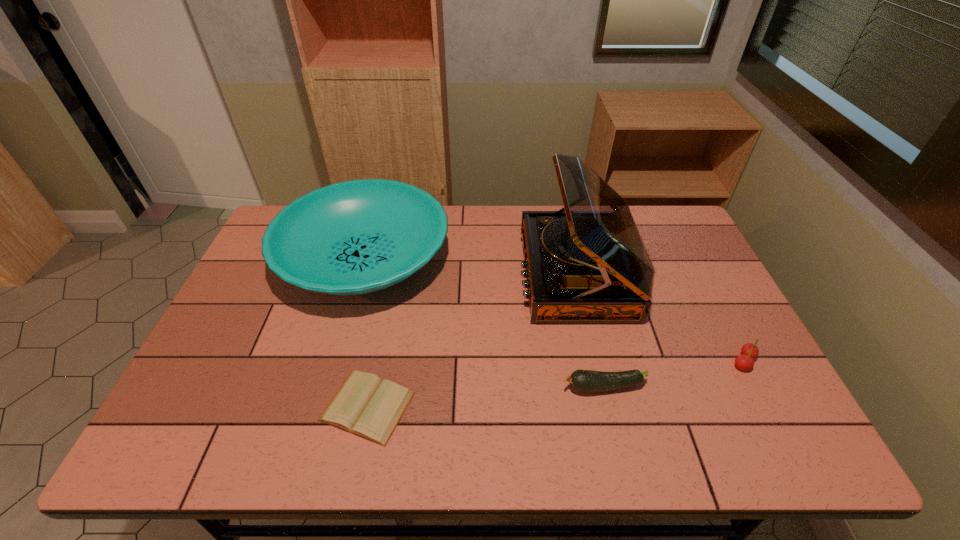
Where is `vacant space situated 0.380m on the left of the cherry`? The image size is (960, 540). vacant space situated 0.380m on the left of the cherry is located at coordinates (582, 361).

Image resolution: width=960 pixels, height=540 pixels. Identify the location of blank space located 0.320m at the blossom end of the zucchini. (430, 387).

Where is `free space located 0.240m at the blossom end of the zucchini`? The image size is (960, 540). free space located 0.240m at the blossom end of the zucchini is located at coordinates (x=463, y=387).

In order to click on vacant space located at the blossom end of the zucchini in this screenshot , I will do `click(484, 387)`.

Where is `free location located on the back of the diary`? free location located on the back of the diary is located at coordinates (387, 309).

The image size is (960, 540). Identify the location of record player located in the far edge section of the desktop. (587, 263).

Locate an element on the screen. This screenshot has width=960, height=540. dish that is at the far edge is located at coordinates (355, 237).

Where is `object situated at the near edge`? This screenshot has height=540, width=960. object situated at the near edge is located at coordinates (366, 406).

Where is `object present at the left edge`? object present at the left edge is located at coordinates (355, 237).

Locate an element on the screen. Image resolution: width=960 pixels, height=540 pixels. object that is at the right edge is located at coordinates (749, 351).